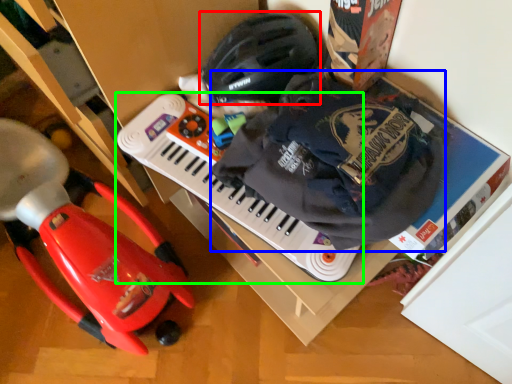
Question: Based on their relative distances, which object is farther from helmet (highlighted by a red box)? Choose from waste (highlighted by a blue box) and musical keyboard (highlighted by a green box).

Choices:
 (A) waste
 (B) musical keyboard

Answer: (A)